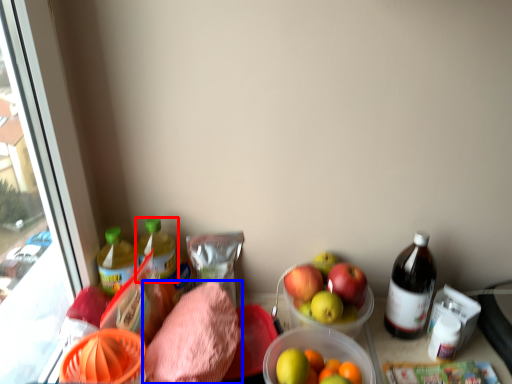
Question: Which object appears closest to the camera in this image, bottle (highlighted by a red box) or waste (highlighted by a blue box)?

Choices:
 (A) bottle
 (B) waste

Answer: (B)